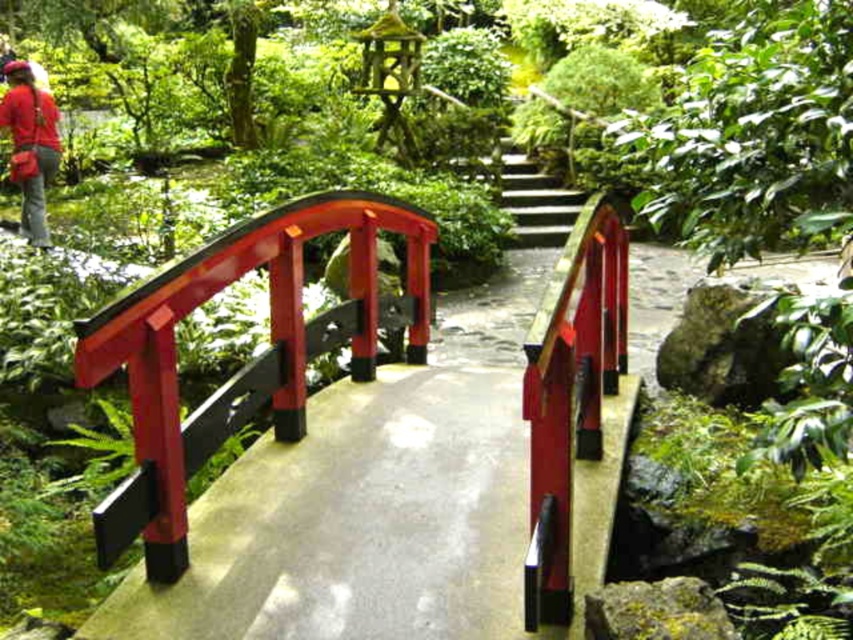
Question: Does glossy wood bridge at center have a smaller size compared to matte red shirt at upper left?

Choices:
 (A) yes
 (B) no

Answer: (B)

Question: Which object appears closest to the camera in this image?

Choices:
 (A) matte red shirt at upper left
 (B) glossy wood bridge at center

Answer: (B)

Question: Among these points, which one is nearest to the camera?

Choices:
 (A) (245, 253)
 (B) (10, 132)

Answer: (A)

Question: Is glossy wood bridge at center behind matte red shirt at upper left?

Choices:
 (A) yes
 (B) no

Answer: (B)

Question: Which point is closer to the camera taking this photo?

Choices:
 (A) (113, 493)
 (B) (47, 129)

Answer: (A)

Question: Does glossy wood bridge at center appear on the right side of matte red shirt at upper left?

Choices:
 (A) no
 (B) yes

Answer: (B)